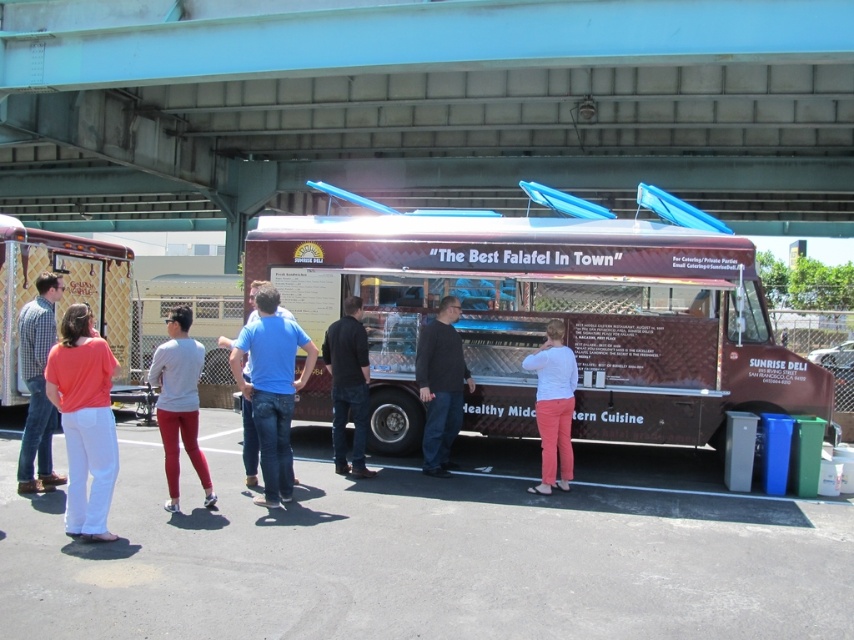
Is matte coral blouse at left below white matte shirt at center?

Actually, matte coral blouse at left is above white matte shirt at center.

Is point (79, 397) closer to viewer compared to point (570, 406)?

Yes, point (79, 397) is in front of point (570, 406).

Locate an element on the screen. The height and width of the screenshot is (640, 854). matte coral blouse at left is located at coordinates (85, 420).

Identify the location of matte coral blouse at left. (85, 420).

Is gray asphalt at lower center shorter than black cotton shirt at center?

Correct, gray asphalt at lower center is not as tall as black cotton shirt at center.

Who is taller, gray asphalt at lower center or black cotton shirt at center?

black cotton shirt at center is taller.

Is point (127, 449) more distant than point (332, 349)?

Yes, point (127, 449) is behind point (332, 349).

Find the location of a particular element. Image resolution: width=854 pixels, height=640 pixels. gray asphalt at lower center is located at coordinates (427, 554).

Who is positioned more to the left, matte plaid shirt at lower left or white matte shirt at center?

matte plaid shirt at lower left is more to the left.

Can you confirm if matte plaid shirt at lower left is positioned to the right of white matte shirt at center?

No, matte plaid shirt at lower left is not to the right of white matte shirt at center.

Who is more distant from viewer, (x=36, y=330) or (x=529, y=490)?

The point (x=529, y=490) is behind.

The image size is (854, 640). I want to click on matte plaid shirt at lower left, so click(x=37, y=387).